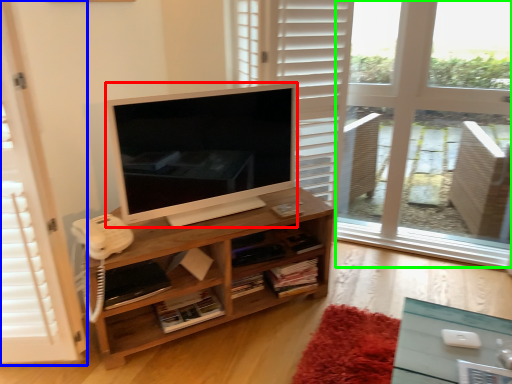
Question: Considering the real-world distances, which object is farthest from television (highlighted by a red box)? screen door (highlighted by a blue box) or window frame (highlighted by a green box)?

Choices:
 (A) screen door
 (B) window frame

Answer: (B)